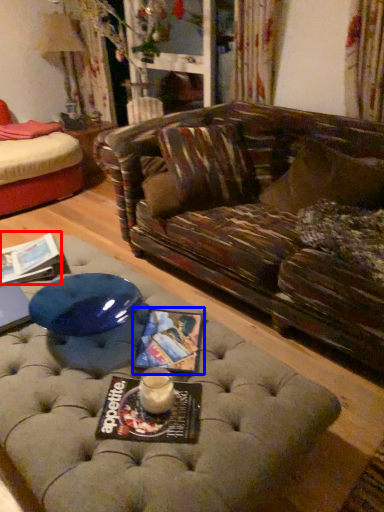
Question: Which object appears farthest to the camera in this image, magazine (highlighted by a red box) or magazine (highlighted by a blue box)?

Choices:
 (A) magazine
 (B) magazine

Answer: (A)